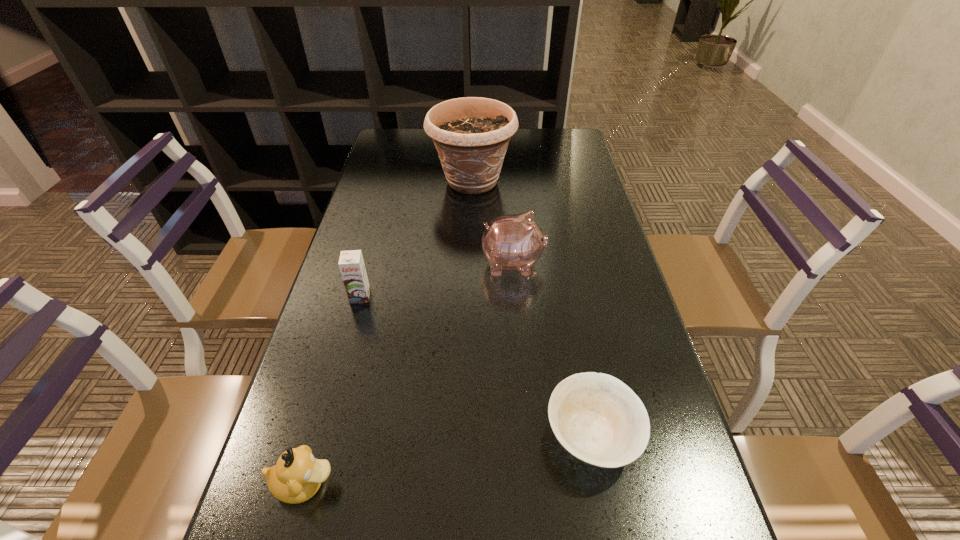
Locate an element on the screen. This screenshot has width=960, height=540. flowerpot is located at coordinates (471, 134).

The image size is (960, 540). Identify the location of the farthest object. (471, 134).

Locate an element on the screen. the second farthest object is located at coordinates (515, 242).

Find the location of `the third nearest object`. the third nearest object is located at coordinates coord(351,264).

Where is `the fourth tallest object`? the fourth tallest object is located at coordinates (297, 476).

You are a GUI agent. You are given a task and a screenshot of the screen. Output one action in this format:
    pyautogui.click(x=<x>, y=<y>)
    Task: Click on the bowl
    This screenshot has height=540, width=960.
    Given the screenshot: What is the action you would take?
    pyautogui.click(x=598, y=419)

You are a GUI agent. You are given a task and a screenshot of the screen. Output one action in this format:
    pyautogui.click(x=<x>, y=<y>)
    Task: Click on the free region located 0.120m on the back of the farthest object
    The height and width of the screenshot is (540, 960).
    Given the screenshot: What is the action you would take?
    pyautogui.click(x=473, y=144)

The width and height of the screenshot is (960, 540). I want to click on free space located on the front facing side of the piggy bank, so click(x=583, y=264).

The width and height of the screenshot is (960, 540). Find the location of `free space located on the front of the chocolate milk`. free space located on the front of the chocolate milk is located at coordinates (317, 457).

Where is `vacant region located on the face of the second shortest object`? vacant region located on the face of the second shortest object is located at coordinates (525, 484).